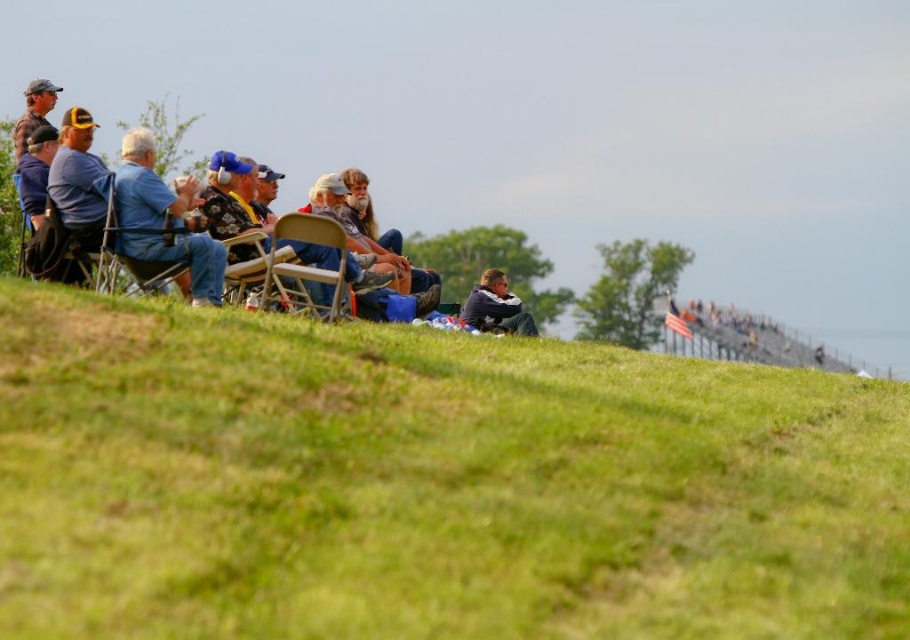
Question: Which is farther from the brown leather jacket at upper left?

Choices:
 (A) denim jacket at center
 (B) blue denim jeans at left
 (C) dark blue jacket at center
 (D) metallic folding chair at center-left

Answer: (C)

Question: Can you confirm if green grassy hillside at lower left is smaller than metallic silver folding chair at center?

Choices:
 (A) yes
 (B) no

Answer: (A)

Question: Does dark blue jacket at center appear on the right side of brown leather jacket at upper left?

Choices:
 (A) yes
 (B) no

Answer: (A)

Question: Can you confirm if metallic folding chair at center-left is bigger than brown leather jacket at upper left?

Choices:
 (A) yes
 (B) no

Answer: (B)

Question: Which of the following is the farthest from the observer?

Choices:
 (A) dark blue jacket at center
 (B) metallic folding chair at center-left
 (C) denim jacket at center
 (D) brown leather jacket at upper left

Answer: (A)

Question: Which object appears closest to the camera in this image?

Choices:
 (A) denim jacket at center
 (B) green grassy hillside at lower left
 (C) metallic silver folding chair at center
 (D) blue denim jeans at left

Answer: (B)